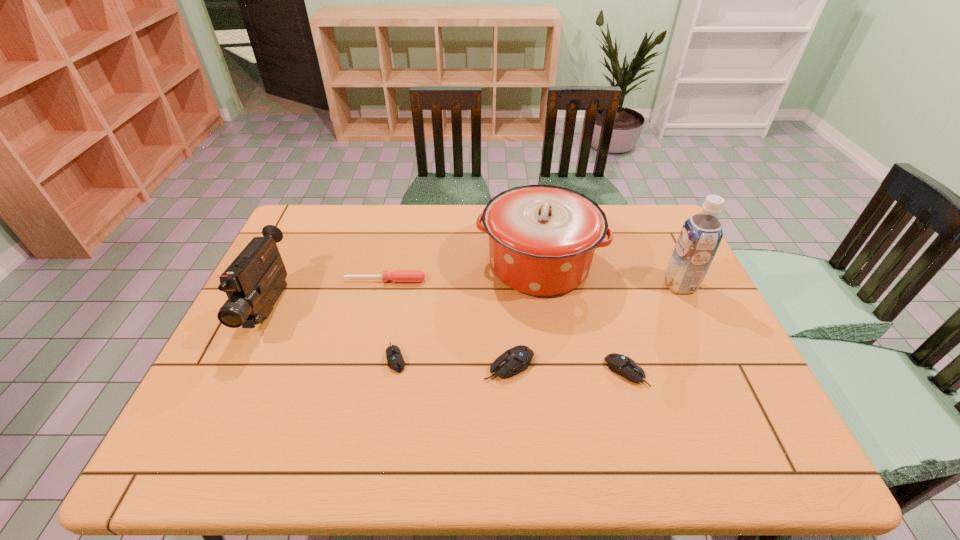
This screenshot has height=540, width=960. I want to click on object that is at the left edge, so click(253, 282).

In order to click on object present at the right edge in this screenshot , I will do `click(701, 234)`.

This screenshot has height=540, width=960. What are the coordinates of `free space at the far edge of the desktop` in the screenshot? It's located at pos(384,227).

This screenshot has width=960, height=540. In order to click on vacant point at the near edge in this screenshot , I will do pos(485,409).

The height and width of the screenshot is (540, 960). Identify the location of vacant point at the left edge. (287, 253).

Locate an element on the screen. This screenshot has height=540, width=960. vacant space at the right edge is located at coordinates pyautogui.click(x=687, y=339).

Find the location of a particular element. This screenshot has width=960, height=540. vacant space at the far left corner of the desktop is located at coordinates (338, 228).

Where is `free spot between the second tallest computer mouse and the casserole`? The height and width of the screenshot is (540, 960). free spot between the second tallest computer mouse and the casserole is located at coordinates (583, 318).

This screenshot has width=960, height=540. I want to click on vacant area between the leftmost object and the casserole, so click(404, 286).

Find the location of a particular element. The height and width of the screenshot is (540, 960). vacant space in between the second tallest computer mouse and the casserole is located at coordinates click(x=583, y=318).